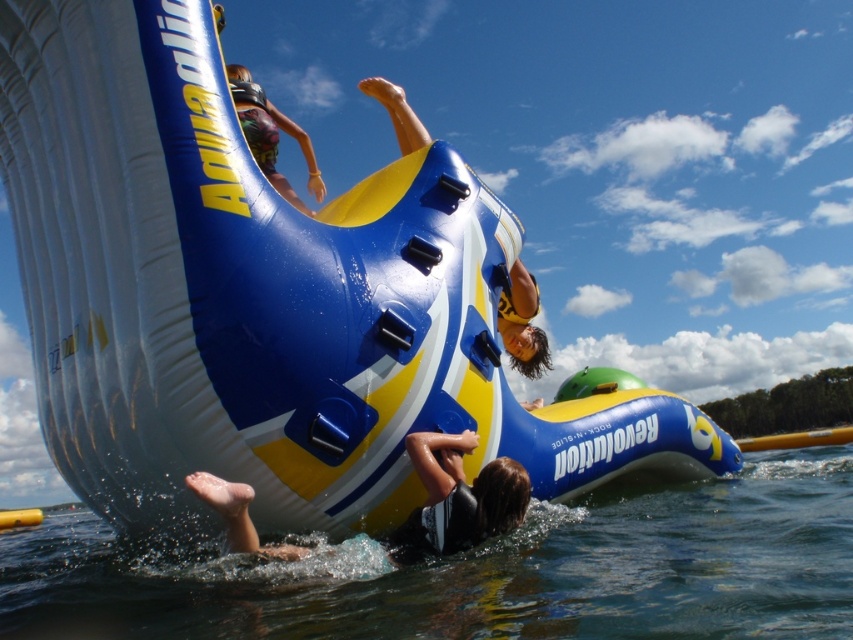
Question: In this image, where is clear water at lower center located relative to multicolored fabric shorts at upper center?

Choices:
 (A) below
 (B) above

Answer: (A)

Question: Which object is positioned farthest from the multicolored fabric shorts at upper center?

Choices:
 (A) clear water at lower center
 (B) dark brown hair at center

Answer: (A)

Question: Which object is positioned closest to the multicolored fabric shorts at upper center?

Choices:
 (A) dark brown hair at center
 (B) dark blue wetsuit at lower center
 (C) clear water at lower center

Answer: (B)

Question: In this image, where is clear water at lower center located relative to dark blue wetsuit at lower center?

Choices:
 (A) below
 (B) above

Answer: (A)

Question: Estimate the real-world distances between objects in this image. Which object is farther from the clear water at lower center?

Choices:
 (A) dark blue wetsuit at lower center
 (B) dark brown hair at center

Answer: (B)

Question: Does clear water at lower center appear on the right side of multicolored fabric shorts at upper center?

Choices:
 (A) no
 (B) yes

Answer: (B)